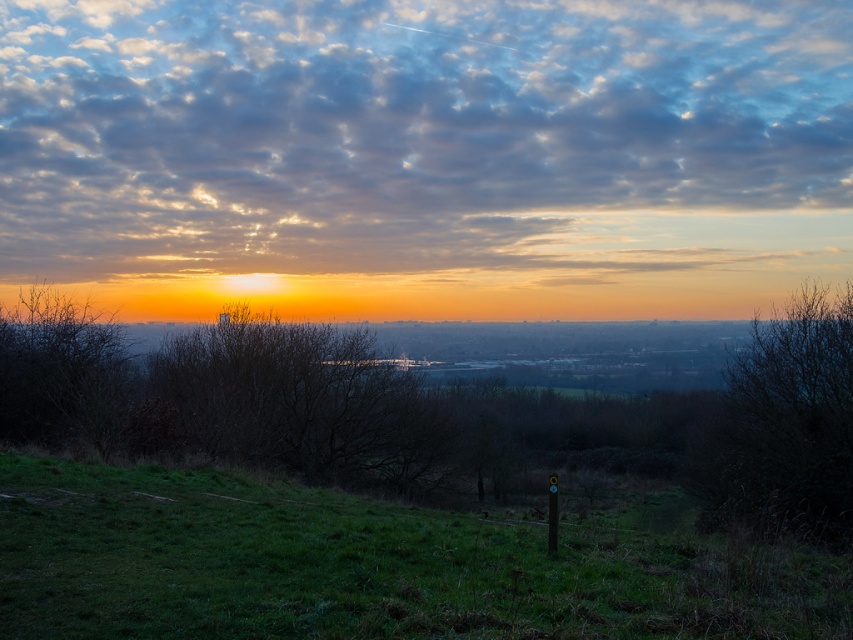
Question: Which object is positioned closest to the brown textured tree at center?

Choices:
 (A) brown matte tree at left
 (B) green grassy at lower center
 (C) brown leafless tree at right

Answer: (A)

Question: Which point is farther to the camera?

Choices:
 (A) green grassy at lower center
 (B) brown matte tree at left
 (C) brown textured tree at center
 (D) brown leafless tree at right

Answer: (C)

Question: Where is brown textured tree at center located in relation to brown leafless tree at right in the image?

Choices:
 (A) left
 (B) right

Answer: (A)

Question: In this image, where is green grassy at lower center located relative to brown leafless tree at right?

Choices:
 (A) below
 (B) above

Answer: (B)

Question: Estimate the real-world distances between objects in this image. Which object is farther from the brown leafless tree at right?

Choices:
 (A) brown matte tree at left
 (B) green grassy at lower center

Answer: (A)

Question: Does brown leafless tree at right appear over brown matte tree at left?

Choices:
 (A) yes
 (B) no

Answer: (B)